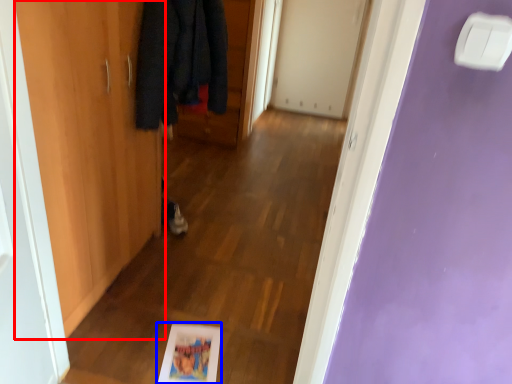
Question: Which of the following is the farthest to the observer, door (highlighted by a red box) or picture frame (highlighted by a blue box)?

Choices:
 (A) door
 (B) picture frame

Answer: (B)